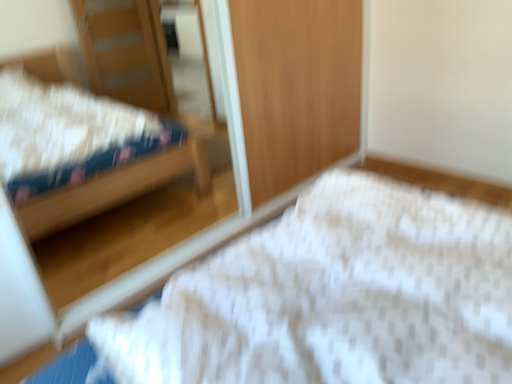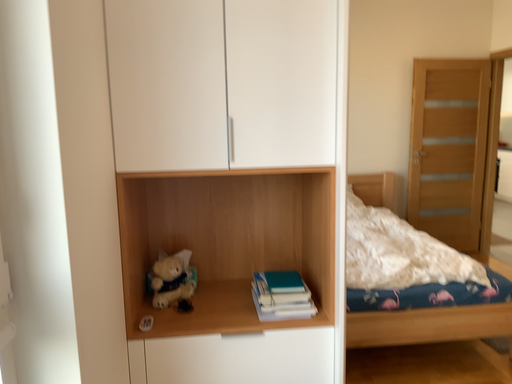
Question: How did the camera likely rotate when shooting the video?

Choices:
 (A) rotated right
 (B) rotated left

Answer: (B)